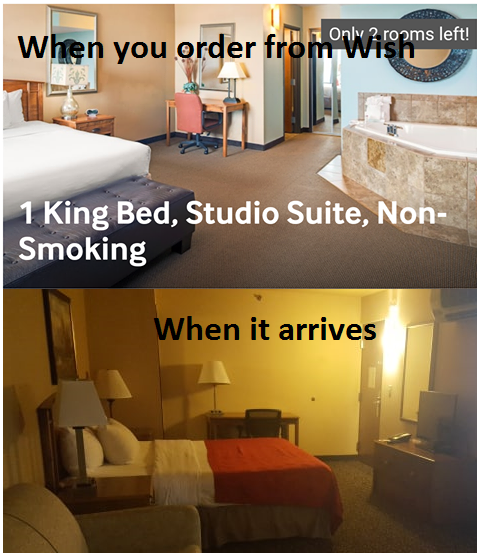
Identify the location of dresser. 416,466.